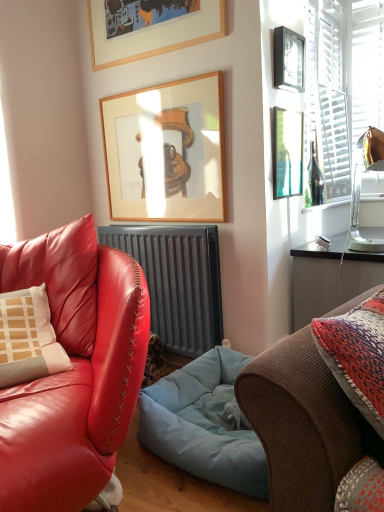
Question: In which direction should I rotate to look at matte leather couch at center, placed as the second studio couch when sorted from right to left?

Choices:
 (A) left
 (B) right

Answer: (A)

Question: From a real-world perspective, is matte leather couch at center, placed as the second studio couch when sorted from right to left, on matte black picture frame at upper right, the second picture frame in the top-to-bottom sequence?

Choices:
 (A) yes
 (B) no

Answer: (B)

Question: Can you confirm if matte leather couch at center, the first studio couch in the left-to-right sequence, is thinner than matte black picture frame at upper right, the second picture frame in the top-to-bottom sequence?

Choices:
 (A) yes
 (B) no

Answer: (B)

Question: Can you confirm if matte leather couch at center, the first studio couch in the left-to-right sequence, is shorter than matte black picture frame at upper right, the second picture frame in the top-to-bottom sequence?

Choices:
 (A) no
 (B) yes

Answer: (A)

Question: Are matte leather couch at center, placed as the second studio couch when sorted from right to left, and matte black picture frame at upper right, the second picture frame in the top-to-bottom sequence, far apart?

Choices:
 (A) yes
 (B) no

Answer: (A)

Question: Is matte leather couch at center, placed as the second studio couch when sorted from right to left, facing towards matte black picture frame at upper right, the second picture frame in the top-to-bottom sequence?

Choices:
 (A) no
 (B) yes

Answer: (A)

Question: Is matte leather couch at center, the first studio couch in the left-to-right sequence, placed right next to matte black picture frame at upper right, the second picture frame in the top-to-bottom sequence?

Choices:
 (A) no
 (B) yes

Answer: (A)

Question: Could you tell me if wooden picture frame at upper center, arranged as the 2th picture frame when ordered from the bottom, is facing wooden picture frame at upper center, placed as the fourth picture frame when sorted from bottom to top?

Choices:
 (A) yes
 (B) no

Answer: (B)

Question: From a real-world perspective, does wooden picture frame at upper center, arranged as the 2th picture frame when ordered from the bottom, stand above wooden picture frame at upper center, placed as the first picture frame when sorted from top to bottom?

Choices:
 (A) no
 (B) yes

Answer: (A)

Question: Is wooden picture frame at upper center, arranged as the 2th picture frame when ordered from the bottom, thinner than wooden picture frame at upper center, placed as the first picture frame when sorted from top to bottom?

Choices:
 (A) yes
 (B) no

Answer: (A)

Question: Considering the relative sizes of wooden picture frame at upper center, which appears as the third picture frame when viewed from the top, and wooden picture frame at upper center, placed as the fourth picture frame when sorted from bottom to top, in the image provided, is wooden picture frame at upper center, which appears as the third picture frame when viewed from the top, taller than wooden picture frame at upper center, placed as the fourth picture frame when sorted from bottom to top,?

Choices:
 (A) yes
 (B) no

Answer: (A)

Question: From the image's perspective, is wooden picture frame at upper center, which appears as the third picture frame when viewed from the top, located above wooden picture frame at upper center, placed as the fourth picture frame when sorted from bottom to top?

Choices:
 (A) no
 (B) yes

Answer: (A)

Question: From the image's perspective, is wooden picture frame at upper center, which appears as the third picture frame when viewed from the top, beneath wooden picture frame at upper center, placed as the fourth picture frame when sorted from bottom to top?

Choices:
 (A) yes
 (B) no

Answer: (A)

Question: Could matte black picture frame at upper right, the second picture frame in the top-to-bottom sequence, be considered to be inside wooden picture frame at upper center, which appears as the third picture frame when viewed from the top?

Choices:
 (A) yes
 (B) no

Answer: (B)